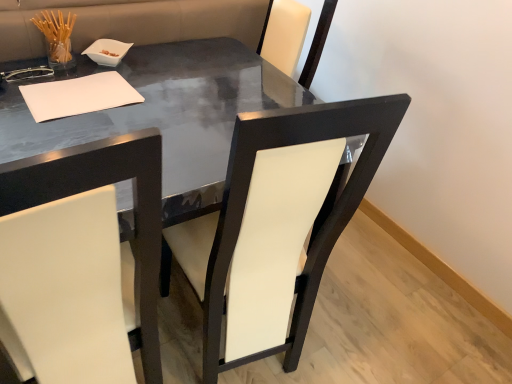
The height and width of the screenshot is (384, 512). In order to click on free space above white paper at upper left (from a real-world perspective) in this screenshot , I will do `click(84, 93)`.